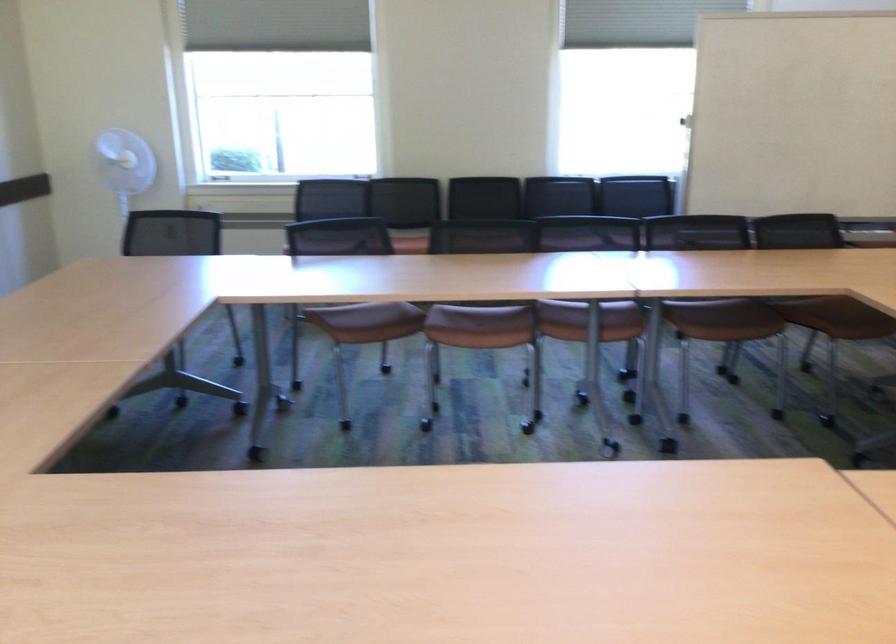
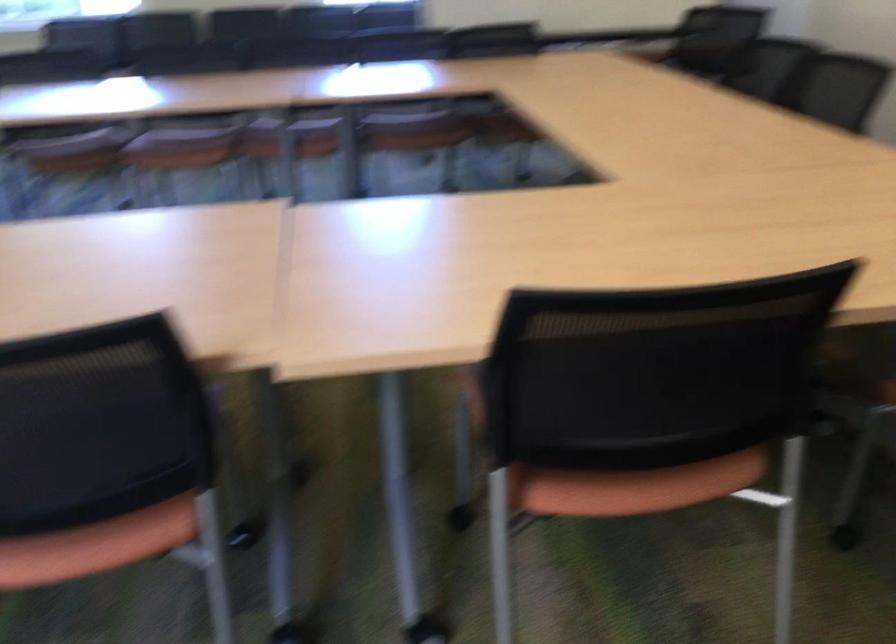
Which direction would the cameraman need to move to produce the second image?

The cameraman moved toward right, backward.